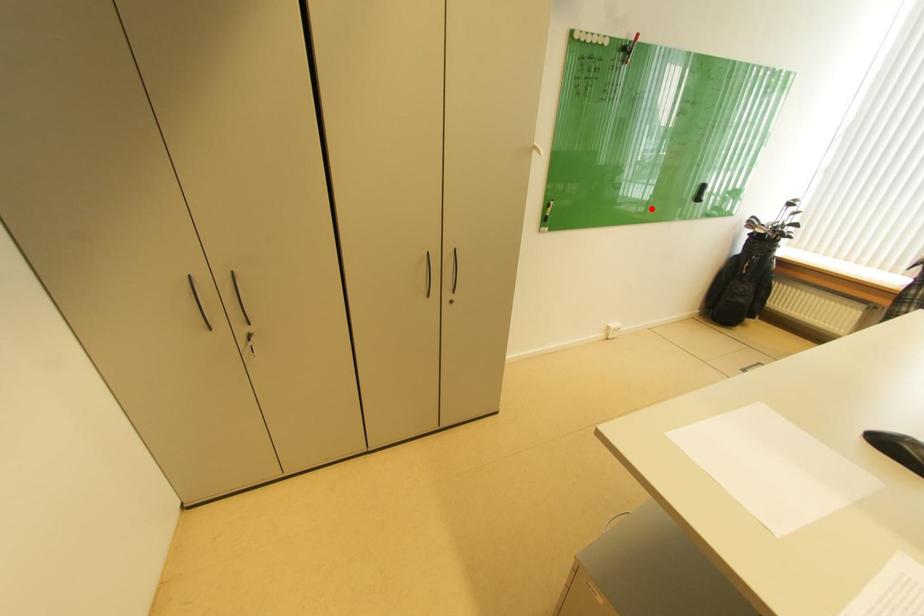
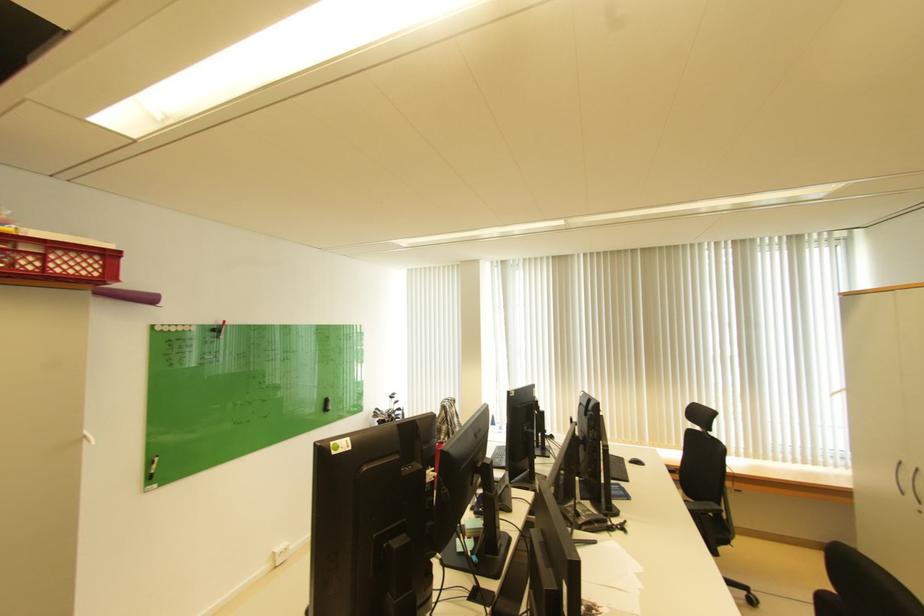
In the second image, find the point that corresponds to the highlighted location in the first image.

(323, 411)